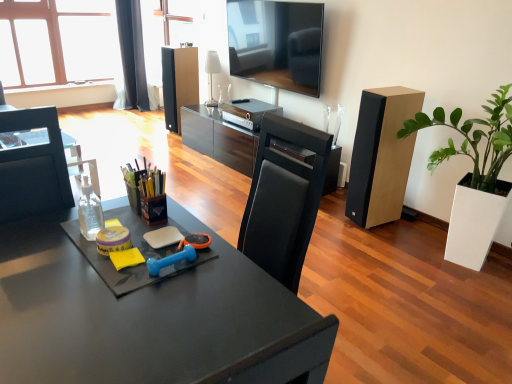
At what (x,y) coordinates should I click in order to perform the action: click on empty space that is to the right of yellow sponge at center. Please return your answer as a coordinate pair (x, y). Looking at the image, I should click on (161, 249).